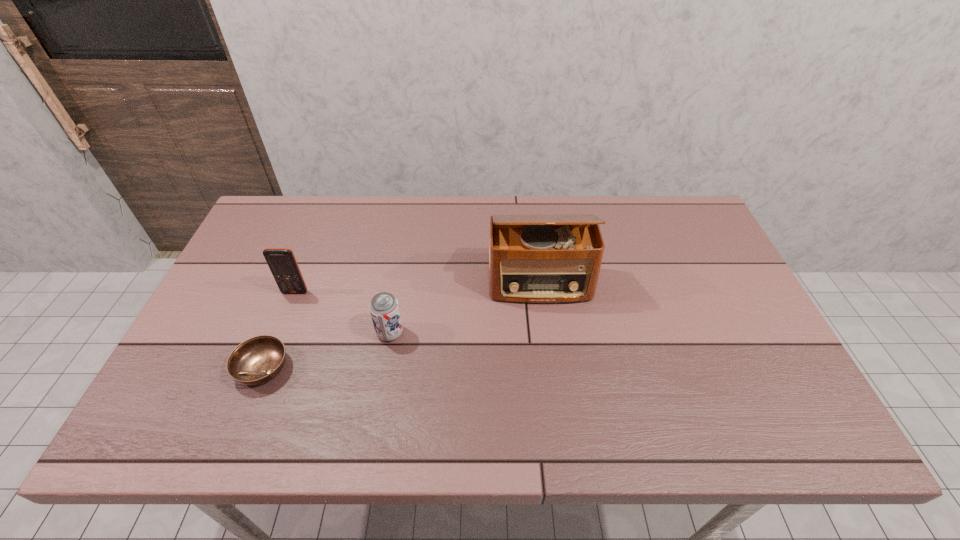
At what (x,y) coordinates should I click in order to perform the action: click on radio receiver. Please return your answer as a coordinate pair (x, y). This screenshot has width=960, height=540. Looking at the image, I should click on (543, 259).

Identify the location of the rightmost object. This screenshot has width=960, height=540. (543, 259).

Locate an element on the screen. cellular telephone is located at coordinates (282, 263).

You are a GUI agent. You are given a task and a screenshot of the screen. Output one action in this format:
    pyautogui.click(x=<x>, y=<y>)
    Task: Click on the second shortest object
    The image size is (960, 540).
    Given the screenshot: What is the action you would take?
    pyautogui.click(x=384, y=308)

At what (x,y) coordinates should I click in order to perform the action: click on the third object from left to right. Please return your answer as a coordinate pair (x, y). This screenshot has height=540, width=960. Looking at the image, I should click on (384, 308).

The height and width of the screenshot is (540, 960). In order to click on the nearest object in this screenshot , I will do `click(257, 360)`.

At what (x,y) coordinates should I click in order to perform the action: click on soup bowl. Please return your answer as a coordinate pair (x, y). The image size is (960, 540). Looking at the image, I should click on (257, 360).

Where is `vacant space situated 0.150m on the front panel of the radio receiver`? The image size is (960, 540). vacant space situated 0.150m on the front panel of the radio receiver is located at coordinates (549, 352).

This screenshot has height=540, width=960. I want to click on free region located 0.180m on the screen of the cellular telephone, so click(274, 349).

The image size is (960, 540). I want to click on vacant space located on the back of the second nearest object, so click(x=405, y=248).